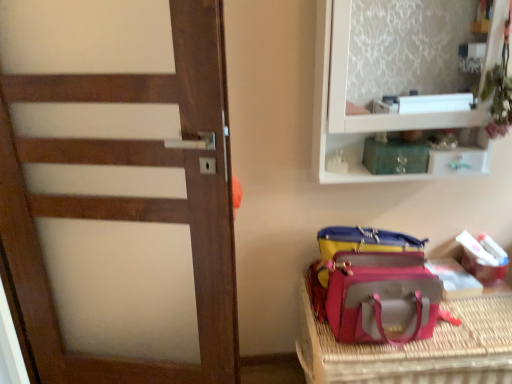
The width and height of the screenshot is (512, 384). Identify the location of vacant space to the right of pink fabric bag at lower right. (473, 327).